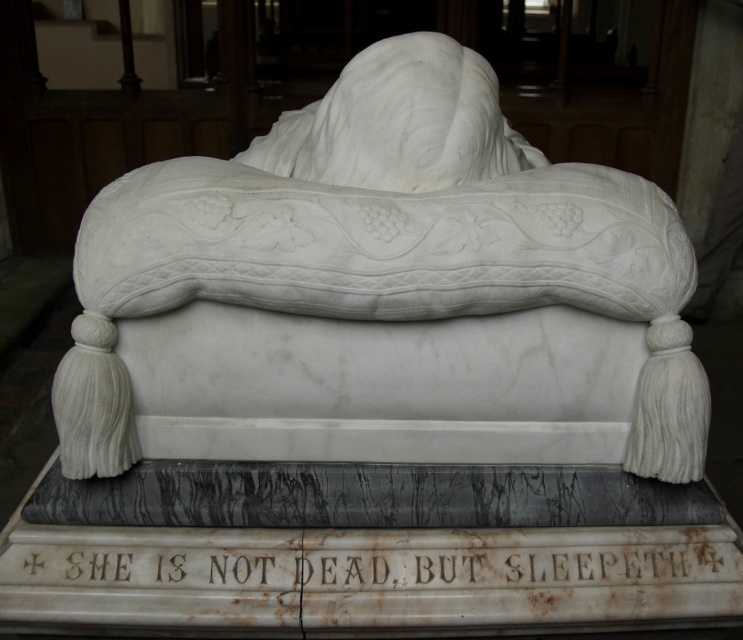
In the scene shown: You are standing in front of the marble tombstone. You see the white marble bed at center and the white marble text at center. Which one is positioned higher up?

The white marble bed at center is located above the white marble text at center, so it is positioned higher up.

You are standing in front of the marble tombstone. There is a point marked at coordinates (389,280). What does this point indicate?

The point marked at coordinates (389,280) indicates the location of the white marble bed at center.

In the scene shown: You are standing in front of the tombstone and want to place a small bouquet of flowers on the white marble bed at center. Where exactly should you place it?

The white marble bed at center is located at point (389, 280), so you should place the bouquet at that coordinate.